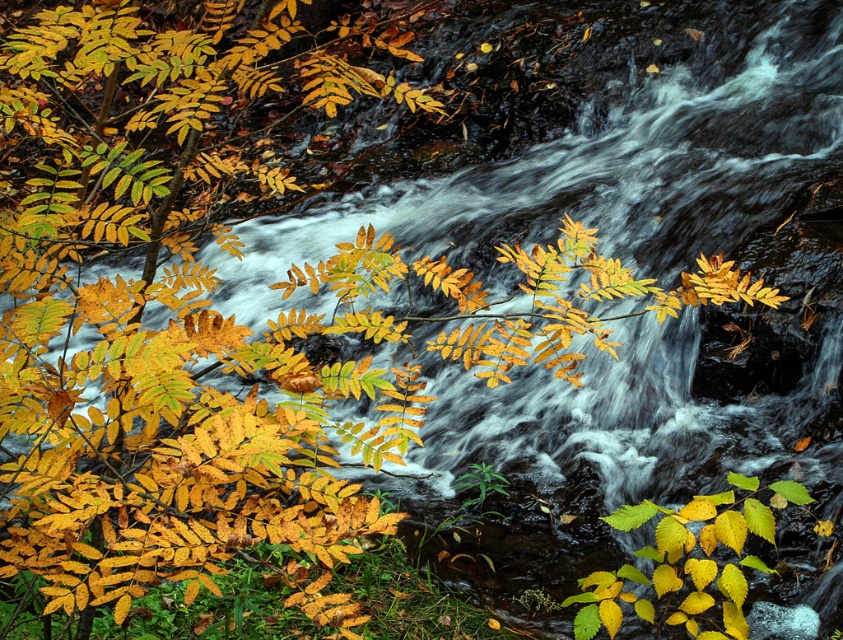
Does green glossy leaf at lower center lie behind yellow matte leaf at lower right?

Yes, green glossy leaf at lower center is behind yellow matte leaf at lower right.

Measure the distance between green glossy leaf at lower center and camera.

green glossy leaf at lower center and camera are 4.74 feet apart.

This screenshot has width=843, height=640. In order to click on green glossy leaf at lower center in this screenshot , I will do `click(629, 516)`.

Who is positioned more to the left, yellow matte leaf at center or yellow matte leaf at lower right?

Positioned to the left is yellow matte leaf at center.

Who is lower down, yellow matte leaf at center or yellow matte leaf at lower right?

yellow matte leaf at center is lower down.

Between point (764, 516) and point (804, 490), which one is positioned in front?

Point (764, 516)

This screenshot has height=640, width=843. I want to click on yellow matte leaf at center, so click(x=758, y=518).

Is point (761, 518) positioned behind point (616, 518)?

No, (761, 518) is closer to viewer.

Is point (744, 506) closer to viewer compared to point (632, 506)?

That is True.

Between point (771, 509) and point (624, 506), which one is positioned in front?

Point (624, 506) is more forward.

Where is `yellow matte leaf at center`? yellow matte leaf at center is located at coordinates (758, 518).